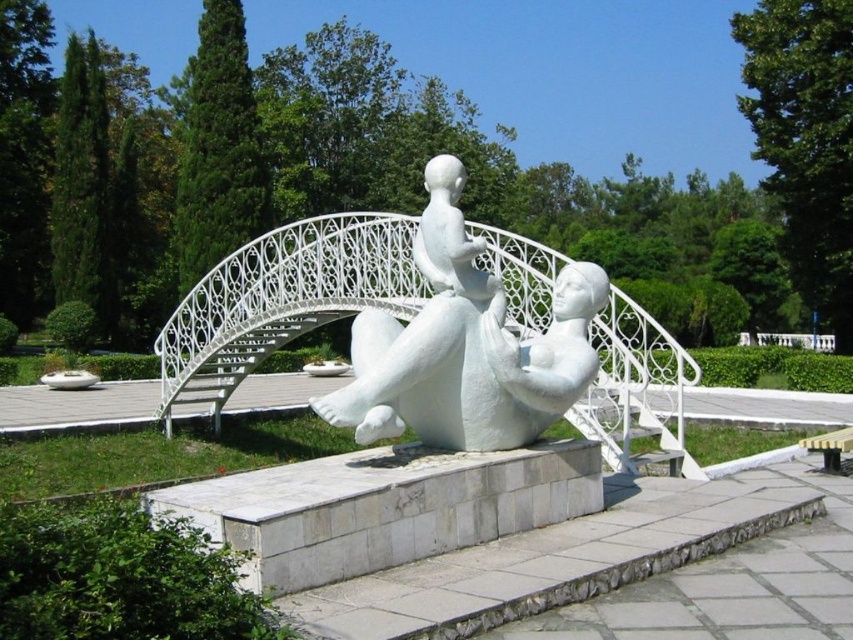
You are standing at the viewpoint where you can see both points marked in the image. Which point is closer to you, point (592, 422) or point (605, 280)?

Point (605, 280) is closer to you because the description states that point (592, 422) is behind point (605, 280).

Where is the white wrought iron bridge at center located in the image?

The white wrought iron bridge at center is located at point (282, 300).